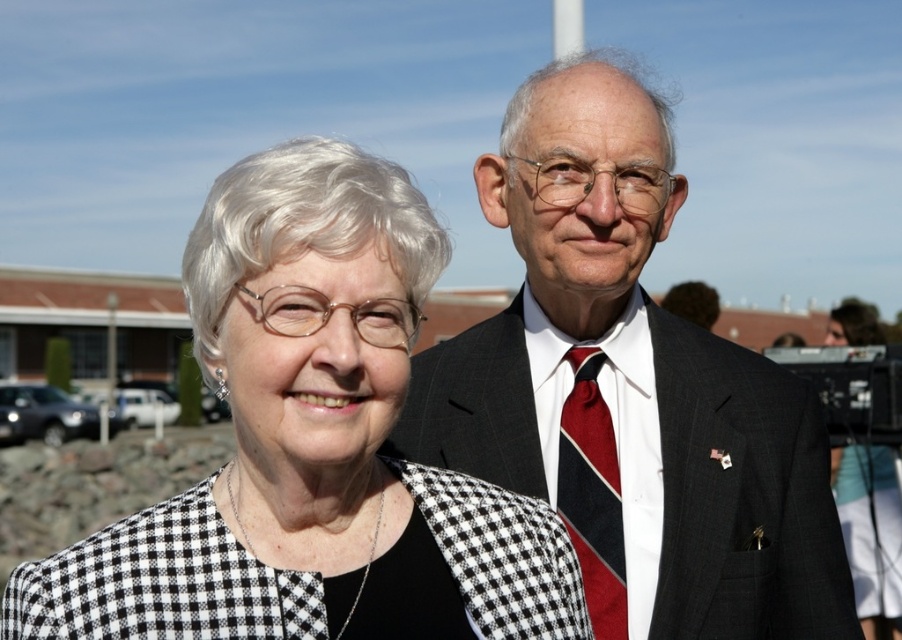
Question: Which object is farther from the camera taking this photo?

Choices:
 (A) dark gray suit at center
 (B) black checkered blazer at center
 (C) red striped tie at center

Answer: (C)

Question: Estimate the real-world distances between objects in this image. Which object is closer to the dark gray suit at center?

Choices:
 (A) red striped tie at center
 (B) black checkered blazer at center

Answer: (A)

Question: Does black checkered blazer at center appear on the right side of dark gray suit at center?

Choices:
 (A) no
 (B) yes

Answer: (A)

Question: Is black checkered blazer at center to the right of dark gray suit at center from the viewer's perspective?

Choices:
 (A) yes
 (B) no

Answer: (B)

Question: Which point is farther to the camera?

Choices:
 (A) dark gray suit at center
 (B) black checkered blazer at center
 (C) red striped tie at center

Answer: (C)

Question: Where is black checkered blazer at center located in relation to red striped tie at center in the image?

Choices:
 (A) left
 (B) right

Answer: (A)